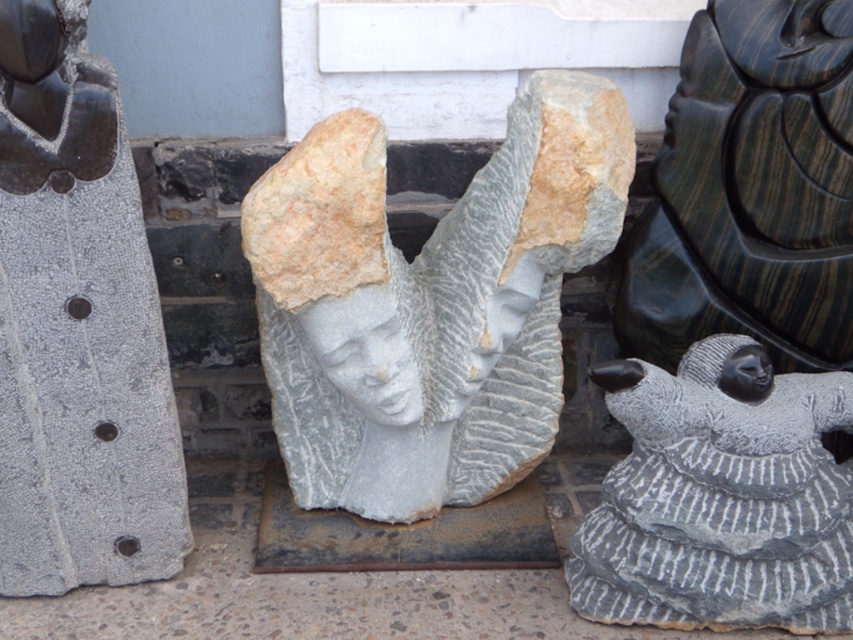
Question: Is the position of gray stone bird at center less distant than that of black glossy head at upper left?

Choices:
 (A) no
 (B) yes

Answer: (A)

Question: Considering the real-world distances, which object is farthest from the black stone head at center?

Choices:
 (A) gray stone statue at center
 (B) gray stone sculpture at center
 (C) gray stone bird at center
 (D) black glossy head at upper left

Answer: (D)

Question: Estimate the real-world distances between objects in this image. Which object is farther from the black wood carving at upper right?

Choices:
 (A) gray stone sculpture at center
 (B) gray stone statue at center
 (C) black glossy head at upper left

Answer: (C)

Question: Does gray stone statue at center have a lesser width compared to black glossy head at upper left?

Choices:
 (A) no
 (B) yes

Answer: (A)

Question: Is gray stone bird at center bigger than black wood carving at upper right?

Choices:
 (A) no
 (B) yes

Answer: (B)

Question: Which point appears farthest from the camera in this image?

Choices:
 (A) (556, 188)
 (B) (730, 627)

Answer: (B)